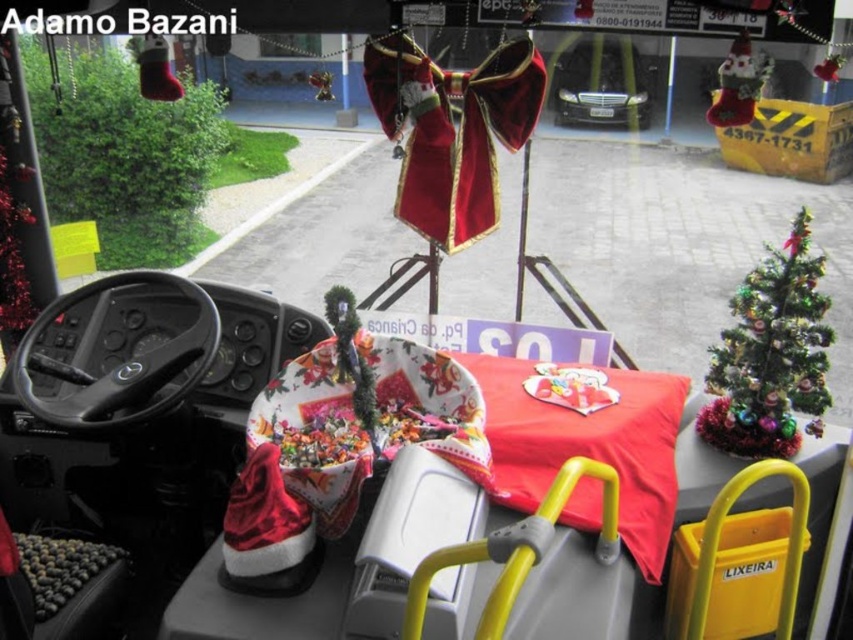
Question: Which point is farther to the camera?

Choices:
 (A) (740, 422)
 (B) (625, 60)

Answer: (B)

Question: Is green artificial christmas tree at right positioned before glossy black car at center?

Choices:
 (A) no
 (B) yes

Answer: (B)

Question: Which of the following is the closest to the observer?

Choices:
 (A) green artificial christmas tree at right
 (B) glossy black car at center

Answer: (A)

Question: Does green artificial christmas tree at right lie behind glossy black car at center?

Choices:
 (A) no
 (B) yes

Answer: (A)

Question: Among these objects, which one is nearest to the camera?

Choices:
 (A) glossy black car at center
 (B) green artificial christmas tree at right

Answer: (B)

Question: Observing the image, what is the correct spatial positioning of green artificial christmas tree at right in reference to glossy black car at center?

Choices:
 (A) left
 (B) right

Answer: (A)